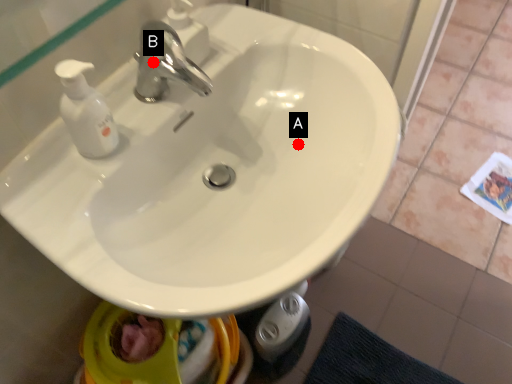
Question: Two points are circled on the image, labeled by A and B beside each circle. Which point is farther from the camera taking this photo?

Choices:
 (A) A is further
 (B) B is further

Answer: (A)